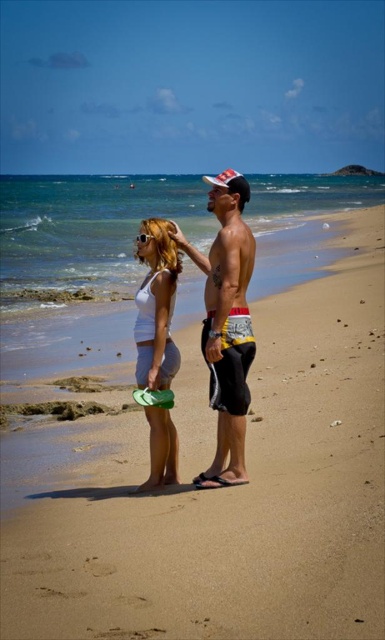
You are standing on the beach and want to walk towards the ocean. There are two points marked on the sand. Which point should you head towards if you want to reach the ocean faster? The points are point (205, 481) and point (154, 444).

Point (205, 481) is in front of point (154, 444), so you should head towards point (205, 481) to reach the ocean faster since it is closer to the ocean.

You are a photographer planning to take a portrait of the person wearing the white matte tank top at center. To ensure the sandy beach at center is visible in the background, where should you position the camera relative to the person?

The sandy beach at center is located below the white matte tank top at center, so positioning the camera slightly above the person will allow the sandy beach at center to be visible in the background.

You are standing on the sandy beach at center and want to reach the ocean waves that are 14.62 feet away. Can you walk directly to them without moving around any obstacles?

The sandy beach at center and viewer are 14.62 feet apart from each other, so yes, you can walk directly to the ocean waves without moving around any obstacles since there are no mentioned obstacles in the scene description.